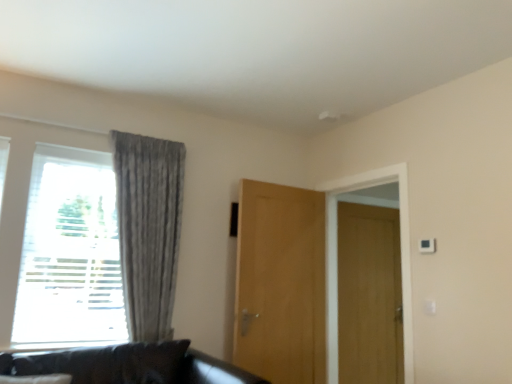
Question: Is light brown wood door at center, arranged as the 1th door when viewed from the front, next to white textured window at left and touching it?

Choices:
 (A) no
 (B) yes

Answer: (A)

Question: Considering the relative positions of light brown wood door at center, the 1th door viewed from the left, and white textured window at left in the image provided, is light brown wood door at center, the 1th door viewed from the left, to the left of white textured window at left from the viewer's perspective?

Choices:
 (A) yes
 (B) no

Answer: (B)

Question: Does light brown wood door at center, the second door in the right-to-left sequence, have a greater width compared to white textured window at left?

Choices:
 (A) yes
 (B) no

Answer: (B)

Question: From a real-world perspective, is light brown wood door at center, the second door when ordered from back to front, under white textured window at left?

Choices:
 (A) no
 (B) yes

Answer: (B)

Question: Is light brown wood door at center, arranged as the 1th door when viewed from the front, not near white textured window at left?

Choices:
 (A) no
 (B) yes

Answer: (B)

Question: Can you confirm if light brown wood door at center, the second door when ordered from back to front, is thinner than white textured window at left?

Choices:
 (A) no
 (B) yes

Answer: (B)

Question: Does white textured window at left turn towards gray textured curtain at left?

Choices:
 (A) yes
 (B) no

Answer: (A)

Question: From the image's perspective, is white textured window at left located above gray textured curtain at left?

Choices:
 (A) yes
 (B) no

Answer: (A)

Question: Can we say white textured window at left lies outside gray textured curtain at left?

Choices:
 (A) no
 (B) yes

Answer: (A)

Question: From a real-world perspective, is white textured window at left under gray textured curtain at left?

Choices:
 (A) yes
 (B) no

Answer: (A)

Question: Would you say gray textured curtain at left is part of white textured window at left's contents?

Choices:
 (A) no
 (B) yes

Answer: (B)

Question: Are white textured window at left and gray textured curtain at left located far from each other?

Choices:
 (A) yes
 (B) no

Answer: (B)

Question: From the image's perspective, is wooden door at right, which ranks as the 2th door in left-to-right order, beneath gray textured curtain at left?

Choices:
 (A) yes
 (B) no

Answer: (A)